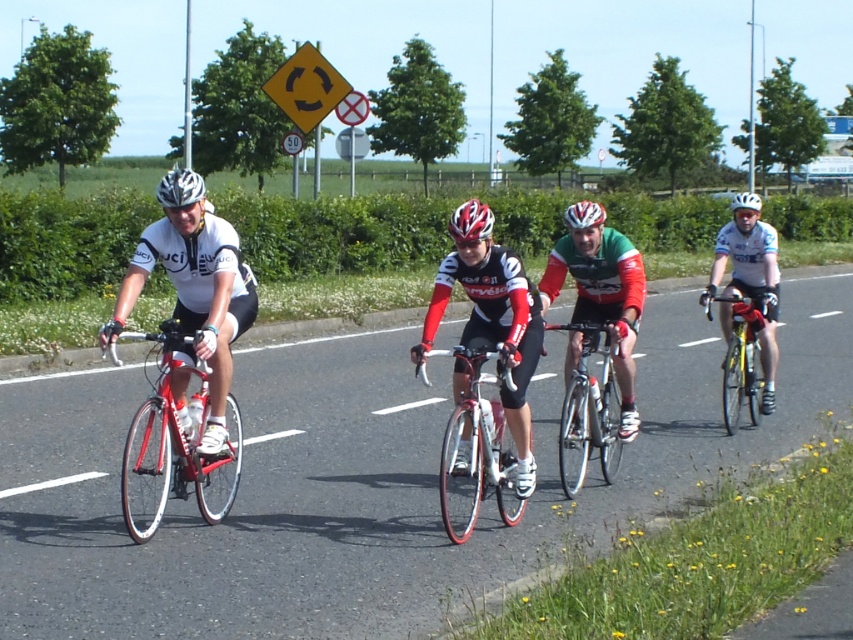
You are a photographer trying to capture a clear shot of both the shiny silver bicycle at center and the white glossy bicycle helmet at center. Since you want to focus on the bicycle, which object should you move your camera closer to?

The shiny silver bicycle at center is positioned on the right side of the white glossy bicycle helmet at center. To focus on the bicycle, you should move your camera closer to the shiny silver bicycle at center.

You are a photographer positioned at the roadside. You want to capture a photo of the shiny red frame at center and the white matte bicycle helmet at left without any obstructions. Given that your camera has a maximum focus range of 8 feet, will you be able to clearly photograph both subjects simultaneously?

The distance between the shiny red frame at center and the white matte bicycle helmet at left is 8.80 feet, which exceeds the camera maximum focus range of 8 feet. Therefore, you cannot clearly photograph both subjects simultaneously.